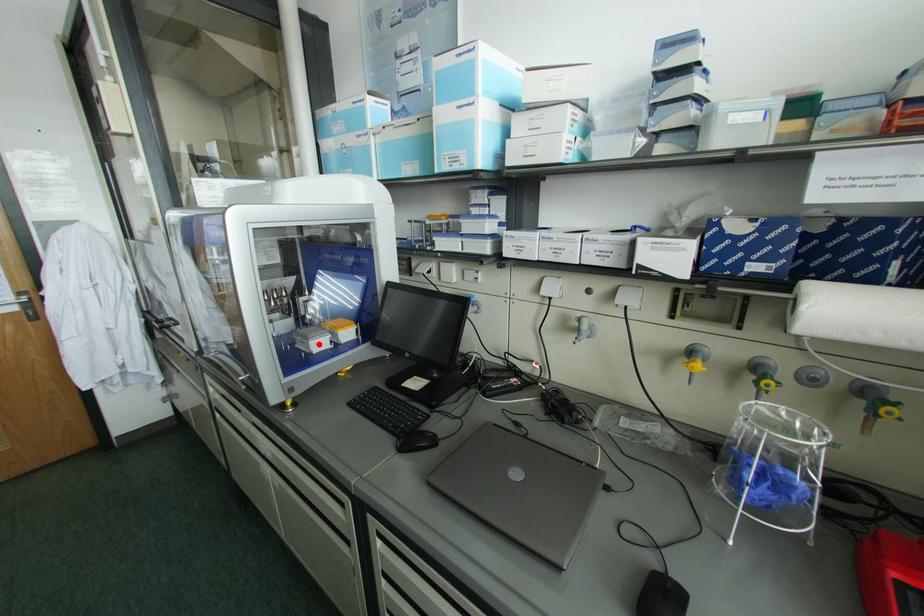
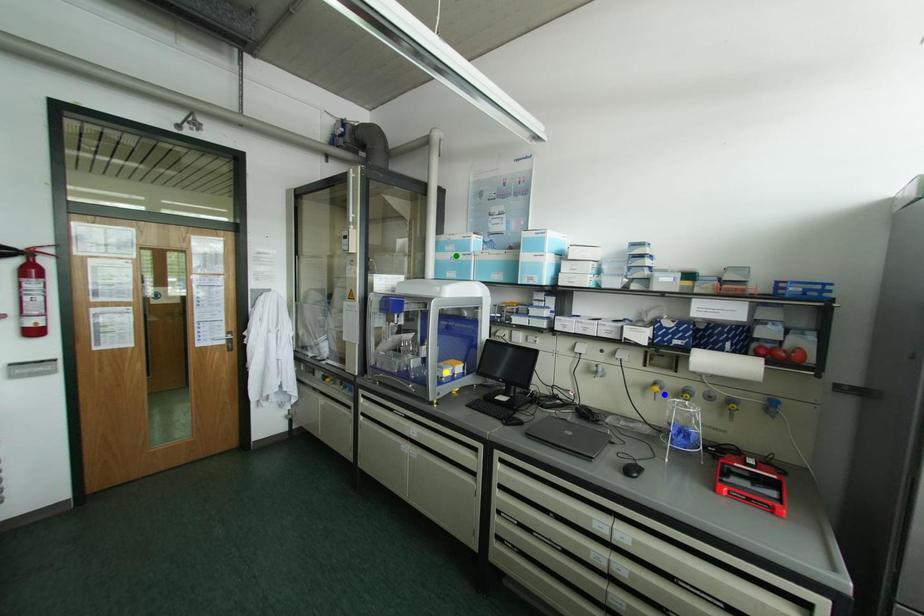
Question: I am providing you with two images of the same scene from different viewpoints. A red point is marked on the first image. You are given multiple points on the second image. Which spot in image 2 lines up with the point in image 1?

Choices:
 (A) blue point
 (B) yellow point
 (C) green point

Answer: (B)